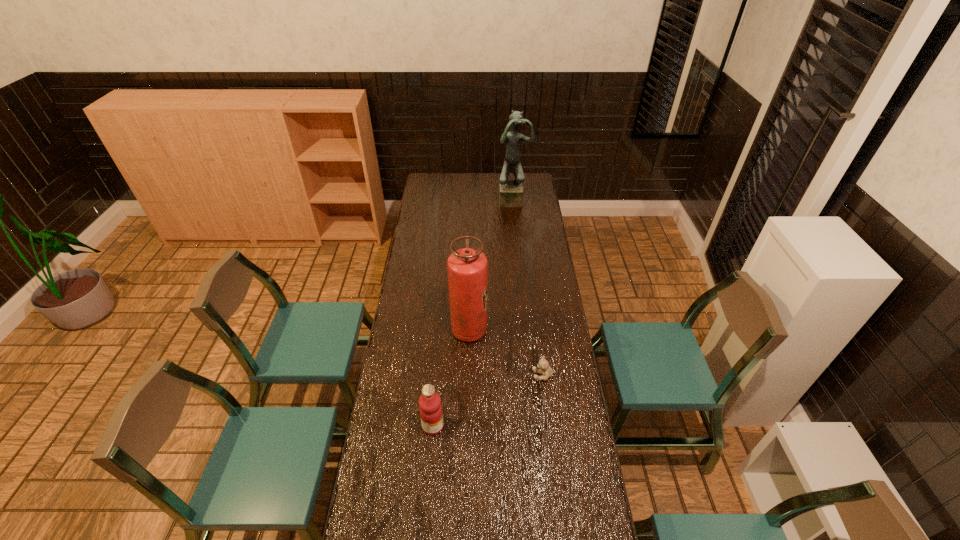
This screenshot has width=960, height=540. I want to click on free spot at the far left corner of the desktop, so click(x=444, y=186).

Where is `vacant space in between the fire extinguisher and the teddy bear`? Image resolution: width=960 pixels, height=540 pixels. vacant space in between the fire extinguisher and the teddy bear is located at coordinates (507, 353).

Locate an element on the screen. The image size is (960, 540). vacant space that is in between the sculpture and the second nearest object is located at coordinates (529, 287).

Image resolution: width=960 pixels, height=540 pixels. Identify the location of free point between the farthest object and the fire extinguisher. (492, 265).

The width and height of the screenshot is (960, 540). Identify the location of free point between the third nearest object and the farthest object. (492, 265).

Where is `free area in between the fire extinguisher and the farthest object`? The height and width of the screenshot is (540, 960). free area in between the fire extinguisher and the farthest object is located at coordinates (492, 265).

The width and height of the screenshot is (960, 540). Identify the location of unoccupied position between the third nearest object and the shortest object. tap(507, 353).

At what (x,y) coordinates should I click in order to perform the action: click on unoccupied area between the teddy bear and the leftmost object. Please return your answer as a coordinate pair (x, y). The image size is (960, 540). Looking at the image, I should click on (489, 401).

This screenshot has width=960, height=540. Identify the location of object that is the second nearest to the farthest object. (543, 365).

You are a GUI agent. You are given a task and a screenshot of the screen. Output one action in this format:
    pyautogui.click(x=<x>, y=<y>)
    Task: Click on the object that can be found as the closest to the second object from left to right
    The image size is (960, 540).
    Given the screenshot: What is the action you would take?
    (x=543, y=365)